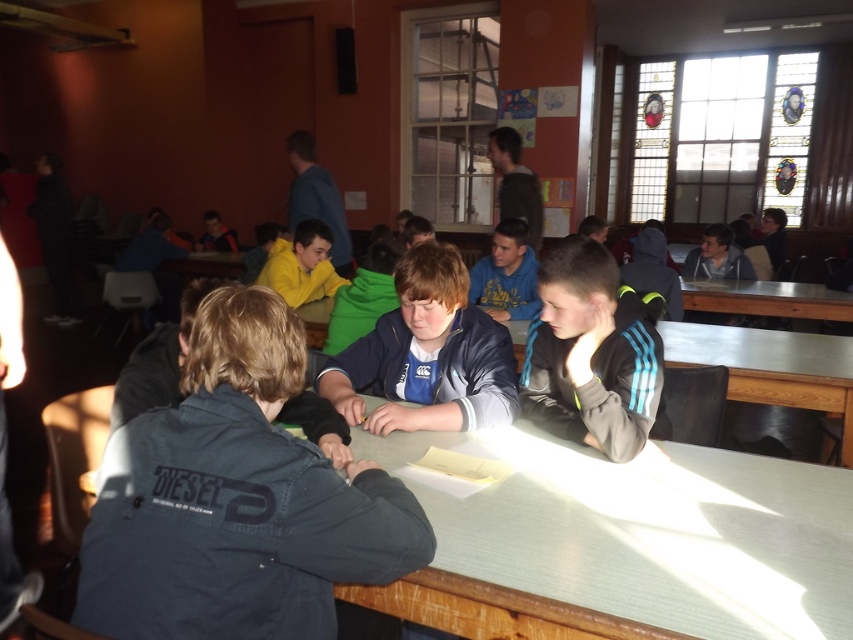
This screenshot has width=853, height=640. What do you see at coordinates (625, 544) in the screenshot?
I see `smooth wooden table at center` at bounding box center [625, 544].

Can you confirm if smooth wooden table at center is shorter than yellow fleece jacket at center?

Yes.

Is point (450, 547) positioned after point (292, 301)?

That is False.

Locate an element on the screen. The image size is (853, 640). smooth wooden table at center is located at coordinates (625, 544).

Which is above, yellow fleece jacket at center or dark gray hoodie at center?

dark gray hoodie at center

Between yellow fleece jacket at center and dark gray hoodie at center, which one appears on the right side from the viewer's perspective?

From the viewer's perspective, dark gray hoodie at center appears more on the right side.

You are a GUI agent. You are given a task and a screenshot of the screen. Output one action in this format:
    pyautogui.click(x=<x>, y=<y>)
    Task: Click on the yellow fleece jacket at center
    
    Given the screenshot: What is the action you would take?
    pyautogui.click(x=303, y=269)

Is blue fabric jacket at center taller than yellow fleece jacket at center?

Incorrect, blue fabric jacket at center's height is not larger of yellow fleece jacket at center's.

What do you see at coordinates (428, 355) in the screenshot?
I see `blue fabric jacket at center` at bounding box center [428, 355].

Identify the location of blue fabric jacket at center. The width and height of the screenshot is (853, 640). (428, 355).